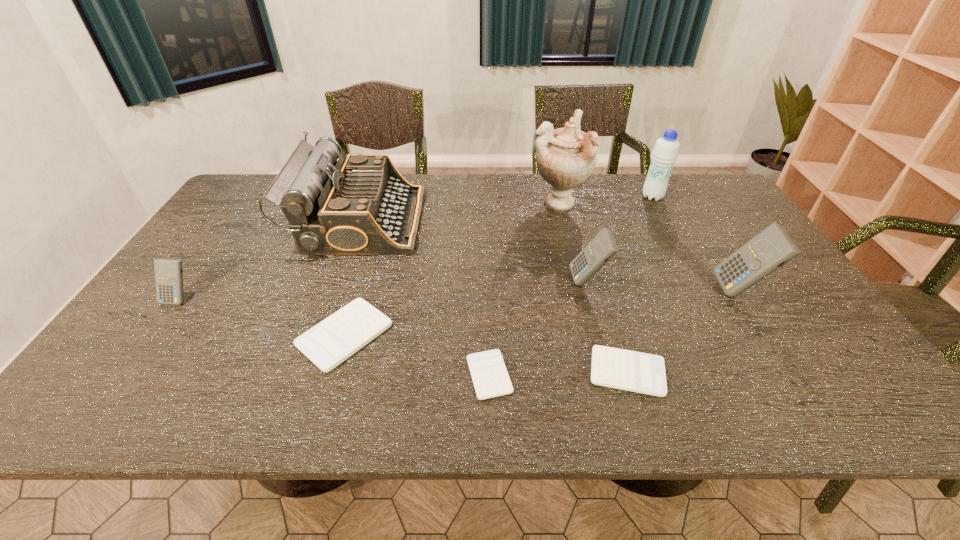
What are the coordinates of `typewriter that is at the far edge` in the screenshot? It's located at (361, 204).

This screenshot has width=960, height=540. Find the location of `object situated at the left edge`. object situated at the left edge is located at coordinates (168, 272).

You are a GUI agent. You are given a task and a screenshot of the screen. Output one action in this format:
    pyautogui.click(x=<x>, y=<y>)
    Task: Click on the object at the right edge
    The height and width of the screenshot is (540, 960).
    Given the screenshot: What is the action you would take?
    pyautogui.click(x=772, y=248)

In the image, there is a desktop. Identify the location of vacant area at the far edge. (610, 176).

Locate an element on the screen. The image size is (960, 540). vacant region at the near edge of the desktop is located at coordinates (182, 384).

In the image, there is a desktop. Identify the location of vacant space at the left edge. The image size is (960, 540). (215, 302).

In the image, there is a desktop. At what (x,y) coordinates should I click in order to perform the action: click on vacant space at the far left corner. Please return your answer as a coordinate pair (x, y). The image size is (960, 540). Looking at the image, I should click on (251, 201).

The height and width of the screenshot is (540, 960). In the image, there is a desktop. Find the location of `vacant space at the near left corner`. vacant space at the near left corner is located at coordinates pos(139,405).

Locate an element on the screen. The image size is (960, 540). vacant point located between the third shortest object and the typewriter is located at coordinates (352, 278).

Identify the location of vacant area that lies between the water bottle and the sixth tallest object. (416, 247).